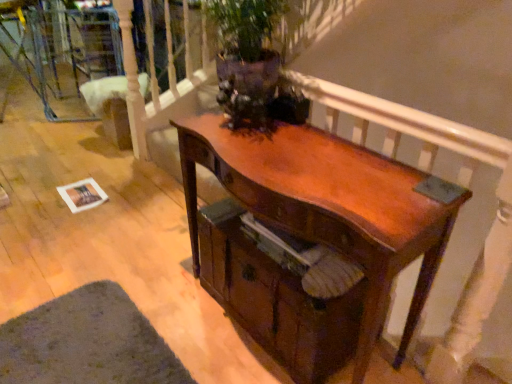
Question: Is green felt mat at lower left smaller than shiny brown wood desk at center?

Choices:
 (A) yes
 (B) no

Answer: (A)

Question: Considering the relative positions of green felt mat at lower left and shiny brown wood desk at center in the image provided, is green felt mat at lower left in front of shiny brown wood desk at center?

Choices:
 (A) no
 (B) yes

Answer: (A)

Question: Is green felt mat at lower left far from shiny brown wood desk at center?

Choices:
 (A) no
 (B) yes

Answer: (A)

Question: Is green felt mat at lower left taller than shiny brown wood desk at center?

Choices:
 (A) no
 (B) yes

Answer: (A)

Question: Is green felt mat at lower left wider than shiny brown wood desk at center?

Choices:
 (A) yes
 (B) no

Answer: (A)

Question: From the image's perspective, is green felt mat at lower left over shiny brown wood desk at center?

Choices:
 (A) no
 (B) yes

Answer: (A)

Question: From the image's perspective, is shiny brown wood desk at center below green felt mat at lower left?

Choices:
 (A) no
 (B) yes

Answer: (A)

Question: Is shiny brown wood desk at center turned away from green felt mat at lower left?

Choices:
 (A) yes
 (B) no

Answer: (B)

Question: Considering the relative sizes of shiny brown wood desk at center and green felt mat at lower left in the image provided, is shiny brown wood desk at center taller than green felt mat at lower left?

Choices:
 (A) no
 (B) yes

Answer: (B)

Question: Does shiny brown wood desk at center appear on the right side of green felt mat at lower left?

Choices:
 (A) no
 (B) yes

Answer: (B)

Question: From a real-world perspective, is shiny brown wood desk at center located beneath green felt mat at lower left?

Choices:
 (A) yes
 (B) no

Answer: (B)

Question: Would you consider shiny brown wood desk at center to be distant from green felt mat at lower left?

Choices:
 (A) yes
 (B) no

Answer: (B)

Question: Considering the relative sizes of shiny brown drawer at center and shiny brown wood desk at center in the image provided, is shiny brown drawer at center taller than shiny brown wood desk at center?

Choices:
 (A) no
 (B) yes

Answer: (A)